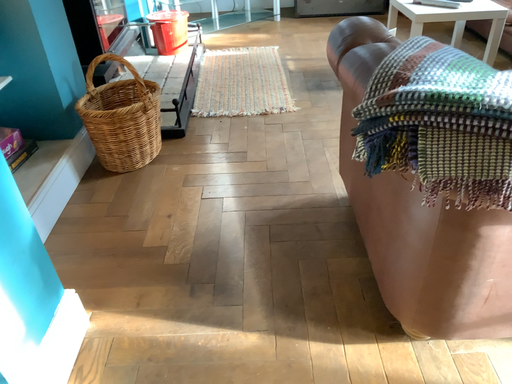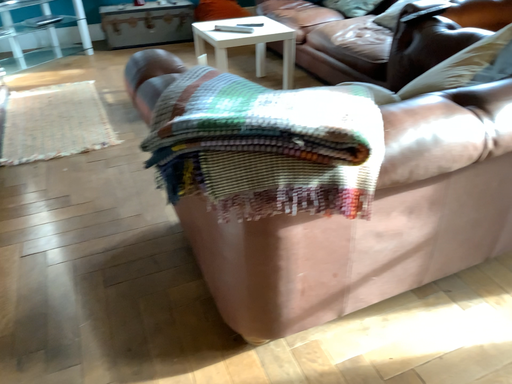
Question: Which way did the camera rotate in the video?

Choices:
 (A) rotated right
 (B) rotated left

Answer: (A)